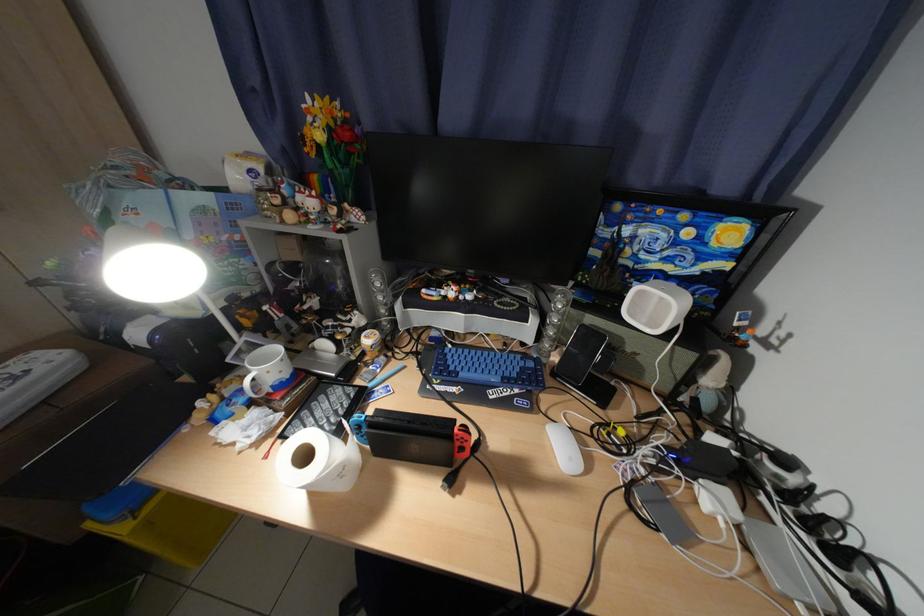
What do you see at coordinates (333, 142) in the screenshot? I see `the red joy-con` at bounding box center [333, 142].